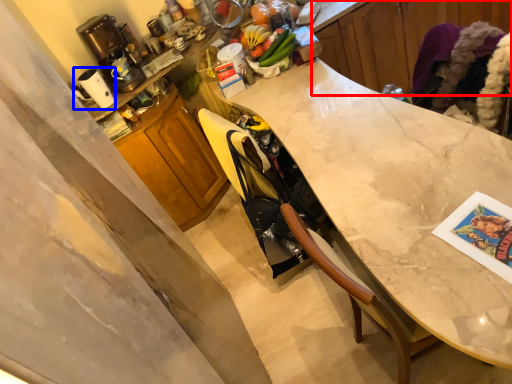
Question: Among these objects, which one is farthest to the camera, cabinetry (highlighted by a red box) or appliance (highlighted by a blue box)?

Choices:
 (A) cabinetry
 (B) appliance

Answer: (A)